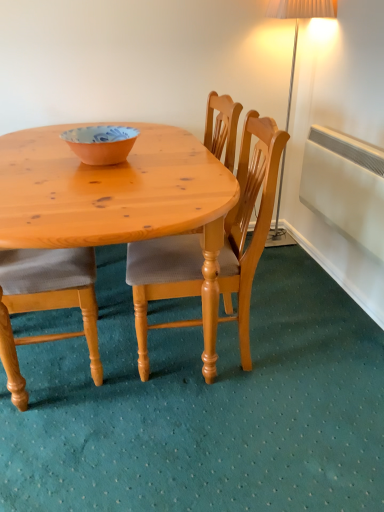
In order to click on vacant area to the right of light brown wooden chair at center in this screenshot , I will do `click(315, 347)`.